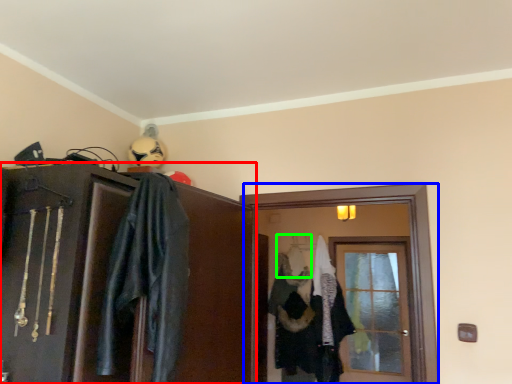
Question: Based on their relative distances, which object is farther from cabinetry (highlighted by a red box)? Choose from screen door (highlighted by a blue box) and hanger (highlighted by a green box).

Choices:
 (A) screen door
 (B) hanger

Answer: (B)